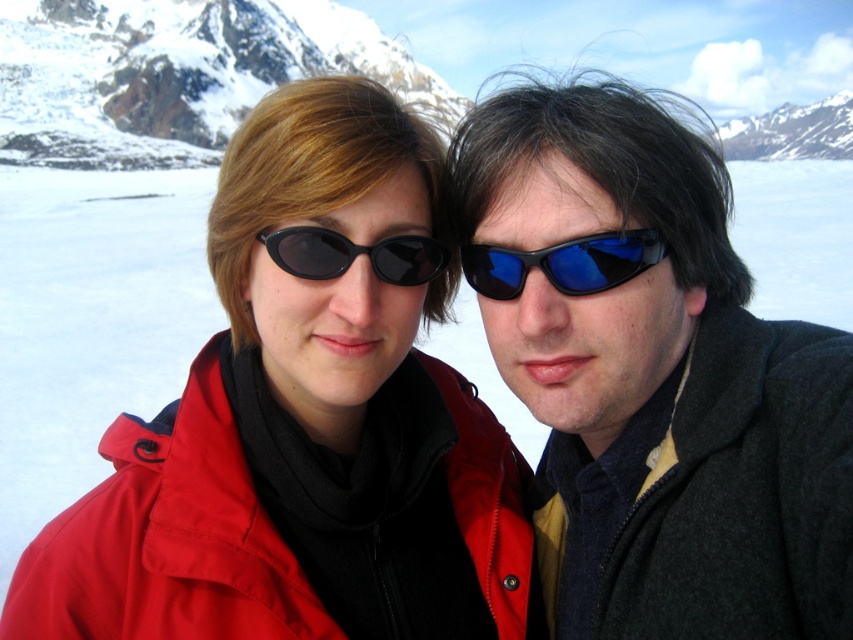
You are a photographer trying to capture a wide shot of the snowy rock mountain at upper right. However, the black matte sunglasses at center are blocking your view. Can you estimate whether the sunglasses are smaller than the mountain in the image?

The black matte sunglasses at center occupies less space than snowy rock mountain at upper right, so they are smaller and might be easier to move out of the way for a clearer view of the mountain.

You are planning to take a photo of the snowy rock mountain at upper right but want to ensure the dark gray woolen jacket at right doesn t block the view. Based on their positions, is the jacket likely to obstruct the mountain in the photo?

The dark gray woolen jacket at right is below the snowy rock mountain at upper right, so it will not obstruct the view of the mountain in the photo.

You are a photographer trying to capture a portrait of both the dark gray woolen jacket at right and the blue reflective plastic sunglasses at center. Given their positions, will you need to adjust your camera angle to include both in the frame?

The dark gray woolen jacket at right is below the blue reflective plastic sunglasses at center, so you will need to adjust your camera angle to include both in the frame.